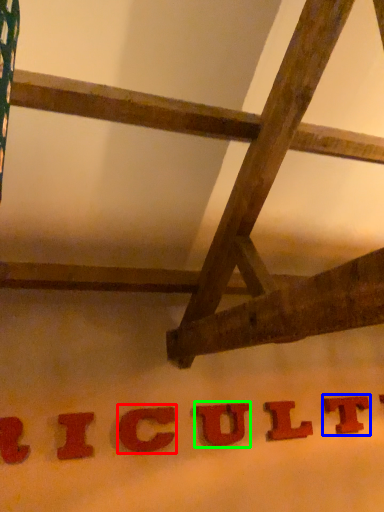
Question: Estimate the real-world distances between objects in this image. Which object is farther from letter (highlighted by a red box), letter (highlighted by a blue box) or letter (highlighted by a green box)?

Choices:
 (A) letter
 (B) letter

Answer: (A)